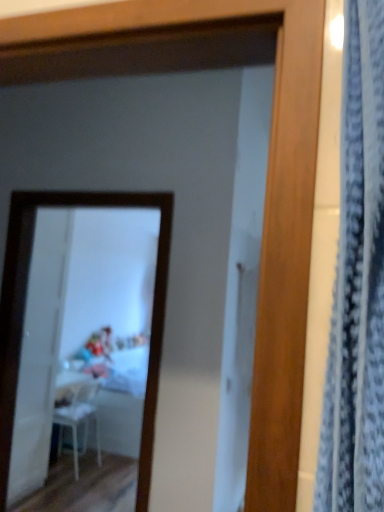
Question: Is the depth of white glossy mirror at upper center less than that of white glossy table at center?

Choices:
 (A) yes
 (B) no

Answer: (A)

Question: Can you confirm if white glossy mirror at upper center is shorter than white glossy table at center?

Choices:
 (A) yes
 (B) no

Answer: (B)

Question: Is white glossy table at center surrounded by white glossy mirror at upper center?

Choices:
 (A) no
 (B) yes

Answer: (A)

Question: Is white glossy mirror at upper center beside white glossy table at center?

Choices:
 (A) no
 (B) yes

Answer: (A)

Question: From a real-world perspective, is white glossy mirror at upper center positioned over white glossy table at center based on gravity?

Choices:
 (A) yes
 (B) no

Answer: (A)

Question: Could you tell me if white glossy mirror at upper center is facing white glossy table at center?

Choices:
 (A) no
 (B) yes

Answer: (A)

Question: From the image's perspective, is white plastic chair at lower left beneath white glossy mirror at upper center?

Choices:
 (A) yes
 (B) no

Answer: (A)

Question: Is white plastic chair at lower left completely or partially outside of white glossy mirror at upper center?

Choices:
 (A) yes
 (B) no

Answer: (A)

Question: From the image's perspective, is white plastic chair at lower left on white glossy mirror at upper center?

Choices:
 (A) yes
 (B) no

Answer: (B)

Question: Is white plastic chair at lower left with white glossy mirror at upper center?

Choices:
 (A) yes
 (B) no

Answer: (B)

Question: Is white glossy mirror at upper center at the back of white plastic chair at lower left?

Choices:
 (A) yes
 (B) no

Answer: (B)

Question: Does white plastic chair at lower left have a lesser height compared to white glossy mirror at upper center?

Choices:
 (A) yes
 (B) no

Answer: (A)

Question: Is white glossy table at center facing towards white plastic chair at lower left?

Choices:
 (A) yes
 (B) no

Answer: (B)